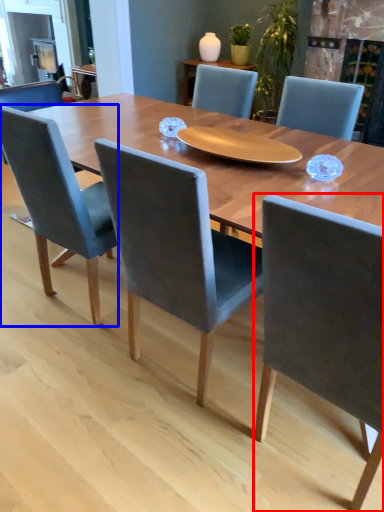
Question: Which point is further to the camera, chair (highlighted by a red box) or chair (highlighted by a blue box)?

Choices:
 (A) chair
 (B) chair

Answer: (B)